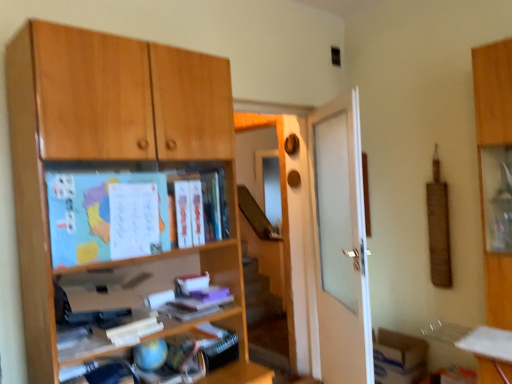
Locate an element on the screen. white matte door at center is located at coordinates (340, 241).

What do you see at coordinates (134, 210) in the screenshot? Image resolution: width=512 pixels, height=384 pixels. I see `blue matte map at upper left` at bounding box center [134, 210].

At what (x,y) coordinates should I click in order to perform the action: click on white matte book at center, the second book positioned from the top. Please return your answer as a coordinate pair (x, y). This screenshot has height=384, width=512. Looking at the image, I should click on (190, 298).

Considering the positions of points (218, 178) and (196, 281), is point (218, 178) farther from camera compared to point (196, 281)?

No, it is in front of (196, 281).

Is matte paper book at center, which appears as the second book when ordered from the bottom, situated inside white matte book at center, marked as the 1th book in a bottom-to-top arrangement, or outside?

matte paper book at center, which appears as the second book when ordered from the bottom, is not enclosed by white matte book at center, marked as the 1th book in a bottom-to-top arrangement.

Find the location of a particular element. book that appears on the right of matte paper book at center, which appears as the second book when ordered from the bottom is located at coordinates (190, 298).

Between matte paper book at center, the first book in the top-to-bottom sequence, and blue matte map at upper left, which one has more height?

Standing taller between the two is matte paper book at center, the first book in the top-to-bottom sequence.

From a real-world perspective, is matte paper book at center, the first book in the top-to-bottom sequence, physically located above or below blue matte map at upper left?

Clearly, from a real-world perspective, matte paper book at center, the first book in the top-to-bottom sequence, is above blue matte map at upper left.

Considering the relative positions of matte paper book at center, the first book in the top-to-bottom sequence, and blue matte map at upper left in the image provided, is matte paper book at center, the first book in the top-to-bottom sequence, to the left of blue matte map at upper left from the viewer's perspective?

No.

Is matte paper book at center, which appears as the second book when ordered from the bottom, positioned far away from blue matte map at upper left?

Actually, matte paper book at center, which appears as the second book when ordered from the bottom, and blue matte map at upper left are a little close together.

Is white matte door at center at the back of blue matte map at upper left?

No.

Considering the sizes of objects blue matte map at upper left and white matte door at center in the image provided, who is shorter, blue matte map at upper left or white matte door at center?

With less height is blue matte map at upper left.

Is the surface of blue matte map at upper left in direct contact with white matte door at center?

They are not placed beside each other.

From the picture: Does blue matte map at upper left turn towards matte paper book at center, the first book in the top-to-bottom sequence?

No, blue matte map at upper left is not turned towards matte paper book at center, the first book in the top-to-bottom sequence.

Can you tell me how much blue matte map at upper left and matte paper book at center, the first book in the top-to-bottom sequence, differ in facing direction?

0.00168 degrees.

From their relative heights in the image, would you say blue matte map at upper left is taller or shorter than matte paper book at center, which appears as the second book when ordered from the bottom?

Considering their sizes, blue matte map at upper left has less height than matte paper book at center, which appears as the second book when ordered from the bottom.

From a real-world perspective, is blue matte map at upper left under matte paper book at center, which appears as the second book when ordered from the bottom?

Correct, in the physical world, blue matte map at upper left is lower than matte paper book at center, which appears as the second book when ordered from the bottom.

Is point (182, 206) closer or farther from the camera than point (293, 334)?

Point (182, 206).

Looking at this image, between matte paper book at center, which appears as the second book when ordered from the bottom, and transparent glass screen door at center, which one has larger width?

matte paper book at center, which appears as the second book when ordered from the bottom, is wider.

Are matte paper book at center, which appears as the second book when ordered from the bottom, and transparent glass screen door at center located far from each other?

matte paper book at center, which appears as the second book when ordered from the bottom, is positioned a significant distance from transparent glass screen door at center.

Is point (127, 246) closer to viewer compared to point (203, 282)?

Yes, point (127, 246) is closer to viewer.

Can you tell me how much blue matte map at upper left and white matte book at center, the second book positioned from the top, differ in facing direction?

The angle between the facing direction of blue matte map at upper left and the facing direction of white matte book at center, the second book positioned from the top, is 0.68 degrees.

Is blue matte map at upper left not close to white matte book at center, the second book positioned from the top?

No, blue matte map at upper left is not far away from white matte book at center, the second book positioned from the top.

How distant is blue matte map at upper left from white matte book at center, the second book positioned from the top?

blue matte map at upper left and white matte book at center, the second book positioned from the top, are 43.67 centimeters apart from each other.

Considering the relative sizes of transparent glass screen door at center and blue matte map at upper left in the image provided, is transparent glass screen door at center taller than blue matte map at upper left?

→ Indeed, transparent glass screen door at center has a greater height compared to blue matte map at upper left.

Is transparent glass screen door at center far away from blue matte map at upper left?

Yes.

Based on the photo, from a real-world perspective, is transparent glass screen door at center under blue matte map at upper left?

Indeed, from a real-world perspective, transparent glass screen door at center is positioned beneath blue matte map at upper left.

Image resolution: width=512 pixels, height=384 pixels. I want to click on book above the white matte book at center, marked as the 1th book in a bottom-to-top arrangement (from a real-world perspective), so click(x=197, y=208).

Find the location of a particular element. Image resolution: width=512 pixels, height=384 pixels. paperback book below the matte paper book at center, the first book in the top-to-bottom sequence (from the image's perspective) is located at coordinates (134, 210).

From the image, which object appears to be nearer to white matte door at center, blue matte map at upper left or transparent glass screen door at center?

The object closer to white matte door at center is transparent glass screen door at center.

Based on their spatial positions, is white matte door at center or white matte book at center, marked as the 1th book in a bottom-to-top arrangement, closer to matte paper book at center, the first book in the top-to-bottom sequence?

white matte book at center, marked as the 1th book in a bottom-to-top arrangement.

Which object lies further to the anchor point transparent glass screen door at center, white matte book at center, marked as the 1th book in a bottom-to-top arrangement, or matte paper book at center, the first book in the top-to-bottom sequence?

white matte book at center, marked as the 1th book in a bottom-to-top arrangement.

In the scene shown: From the image, which object appears to be nearer to blue matte map at upper left, transparent glass screen door at center or matte paper book at center, the first book in the top-to-bottom sequence?

Among the two, matte paper book at center, the first book in the top-to-bottom sequence, is located nearer to blue matte map at upper left.

From the image, which object appears to be nearer to white matte door at center, white matte book at center, marked as the 1th book in a bottom-to-top arrangement, or blue matte map at upper left?

Among the two, white matte book at center, marked as the 1th book in a bottom-to-top arrangement, is located nearer to white matte door at center.

When comparing their distances from transparent glass screen door at center, does white matte door at center or white matte book at center, marked as the 1th book in a bottom-to-top arrangement, seem further?

Based on the image, white matte book at center, marked as the 1th book in a bottom-to-top arrangement, appears to be further to transparent glass screen door at center.

When comparing their distances from white matte book at center, the second book positioned from the top, does transparent glass screen door at center or matte paper book at center, which appears as the second book when ordered from the bottom, seem further?

Based on the image, transparent glass screen door at center appears to be further to white matte book at center, the second book positioned from the top.

Estimate the real-world distances between objects in this image. Which object is closer to matte paper book at center, the first book in the top-to-bottom sequence, transparent glass screen door at center or white matte book at center, marked as the 1th book in a bottom-to-top arrangement?

white matte book at center, marked as the 1th book in a bottom-to-top arrangement, is positioned closer to the anchor matte paper book at center, the first book in the top-to-bottom sequence.

Identify the location of paperback book that lies between matte paper book at center, which appears as the second book when ordered from the bottom, and white matte book at center, marked as the 1th book in a bottom-to-top arrangement, from top to bottom. (134, 210).

Where is `screen door between blue matte map at upper left and white matte door at center`? The width and height of the screenshot is (512, 384). screen door between blue matte map at upper left and white matte door at center is located at coordinates click(x=283, y=226).

Identify the location of screen door between matte paper book at center, which appears as the second book when ordered from the bottom, and white matte door at center from left to right. The width and height of the screenshot is (512, 384). (283, 226).

Locate an element on the screen. Image resolution: width=512 pixels, height=384 pixels. book located between matte paper book at center, the first book in the top-to-bottom sequence, and white matte door at center in the left-right direction is located at coordinates (190, 298).